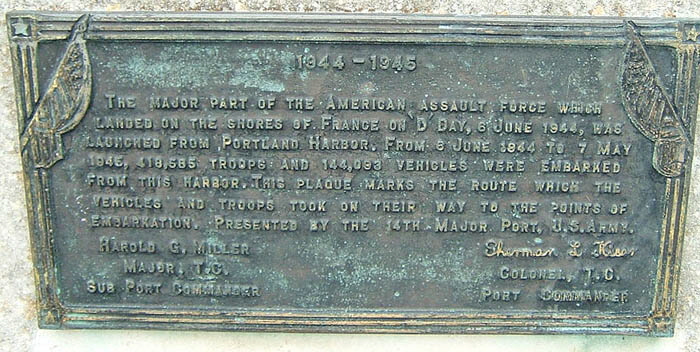
Find the location of a particular element. right side of frame around plaque is located at coordinates 677,195.